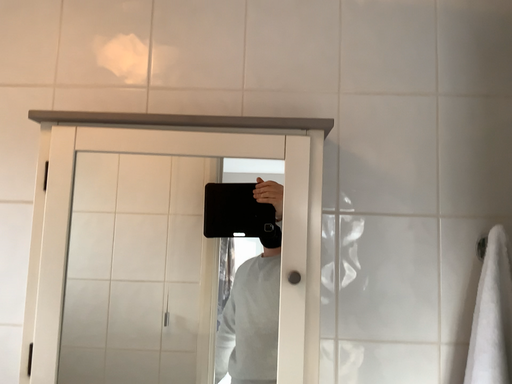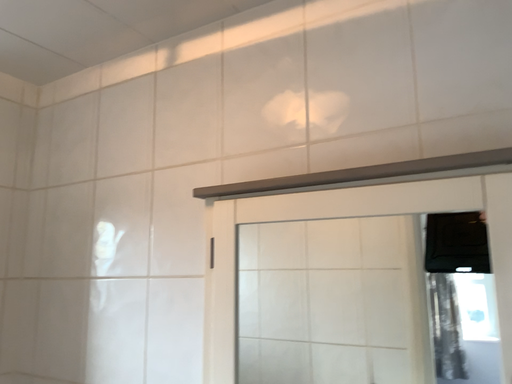
Question: Which way did the camera rotate in the video?

Choices:
 (A) rotated right
 (B) rotated left

Answer: (B)